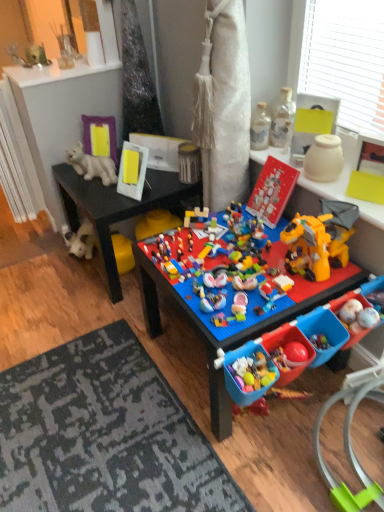
This screenshot has height=512, width=384. What are the coordinates of `vacant space in between black matte desk at center and white plush dog at lower left, the 1th toy from the left` in the screenshot? It's located at (90, 276).